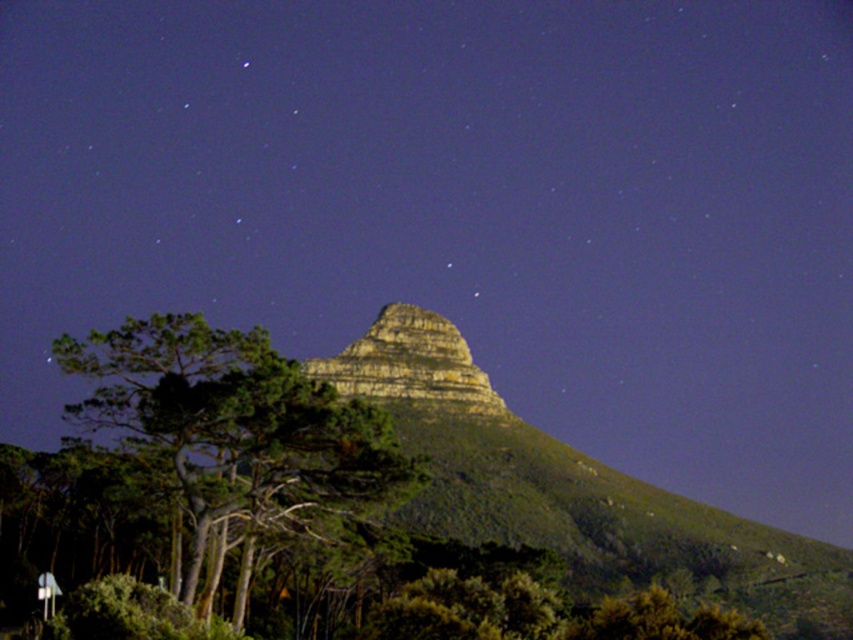
You are standing at the base of the mountain and want to reach the point marked at coordinates point (125,372). Given that the distance between you and this point is 154.65 meters, can you estimate how long it would take to walk there at a leisurely pace of 3 km per hour?

The distance to point (125,372) is 154.65 meters. At a leisurely pace of 3 km per hour, it would take approximately 3 minutes to reach the point.